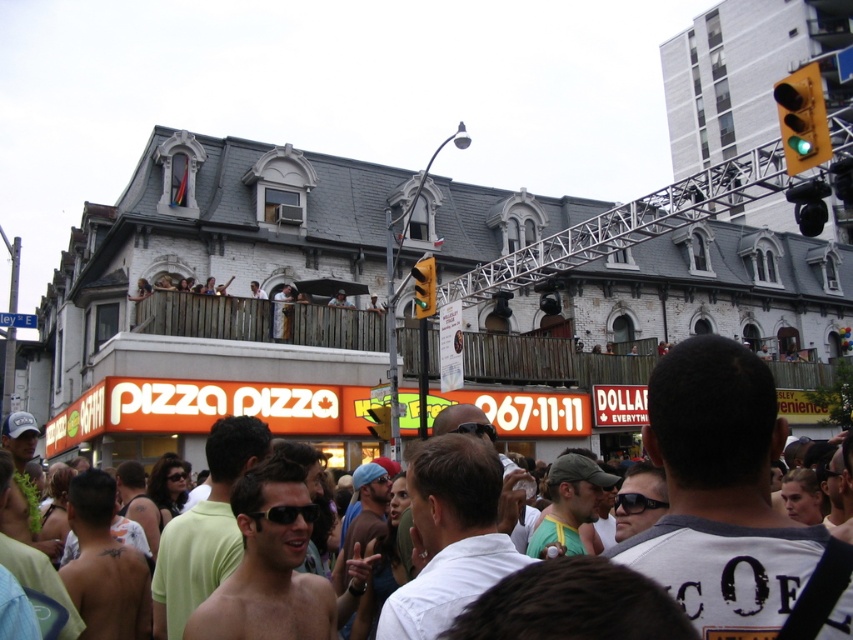
Question: Which of these objects is positioned closest to the green fabric cap at center?

Choices:
 (A) green matte traffic light at upper right
 (B) white cotton t-shirt at center
 (C) yellow plastic traffic light at upper center

Answer: (B)

Question: Can you confirm if yellow-green plastic traffic light at upper center is bigger than yellow plastic traffic light at upper center?

Choices:
 (A) no
 (B) yes

Answer: (B)

Question: In this image, where is white cotton t-shirt at center located relative to green glass traffic light at upper right?

Choices:
 (A) left
 (B) right

Answer: (A)

Question: Which point is closer to the camera taking this photo?

Choices:
 (A) (427, 298)
 (B) (345, 301)
 (C) (827, 212)

Answer: (C)

Question: Is shiny black skin at center further to the viewer compared to green matte traffic light at upper right?

Choices:
 (A) yes
 (B) no

Answer: (B)

Question: Which of these objects is positioned closest to the light brown wooden railing at upper center?

Choices:
 (A) green matte traffic light at upper right
 (B) green glass traffic light at upper right

Answer: (A)